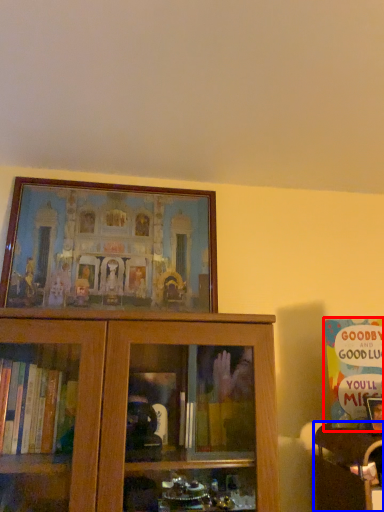
Question: Which point is further to the camera, book (highlighted by a red box) or furniture (highlighted by a blue box)?

Choices:
 (A) book
 (B) furniture

Answer: (A)